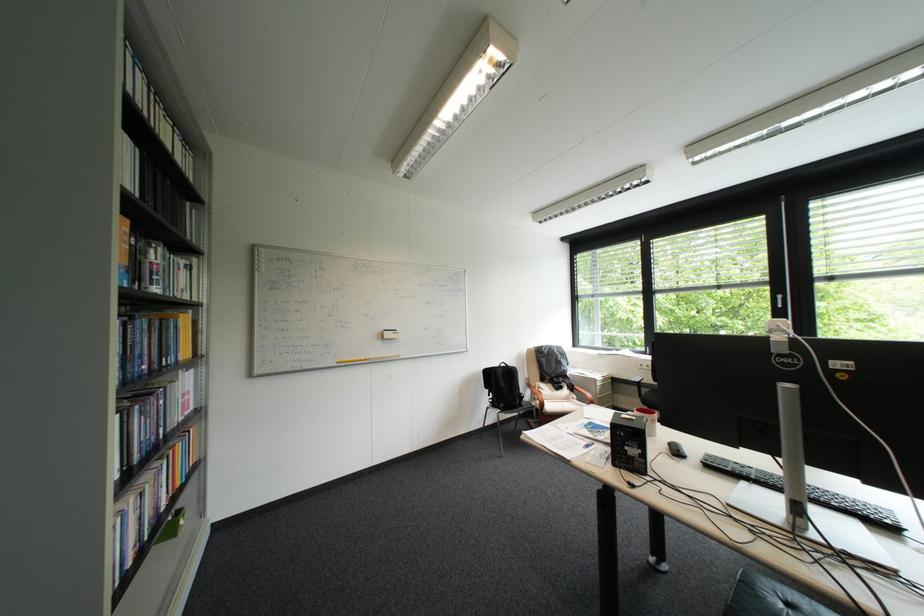
I want to click on chair sitting surface, so click(x=561, y=391).